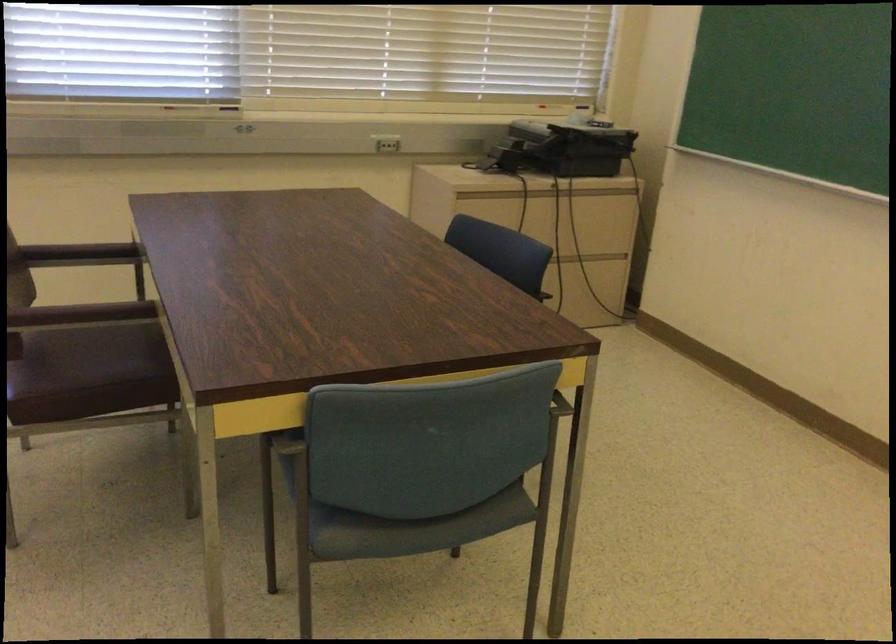
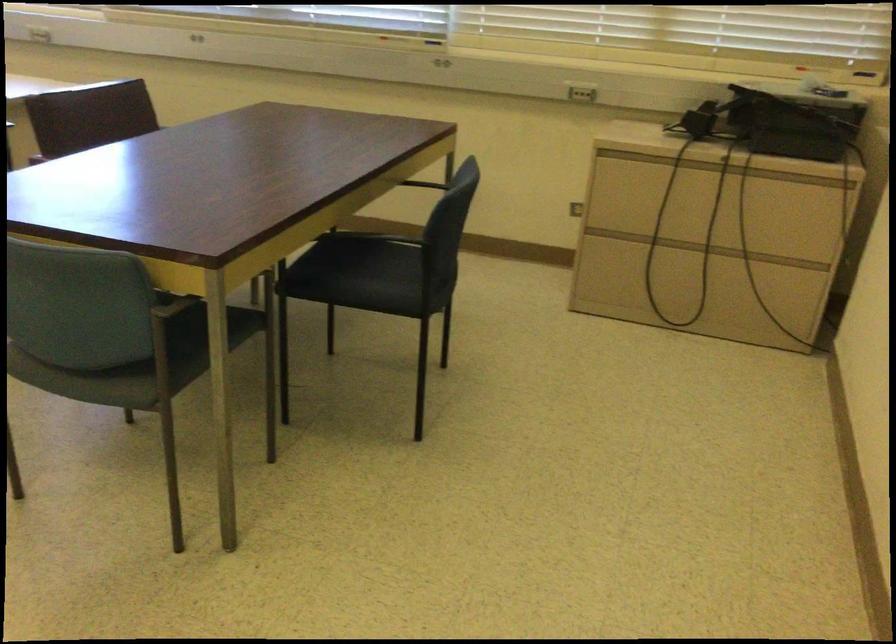
Where in the second image is the point corresponding to [543,194] from the first image?

(700, 167)